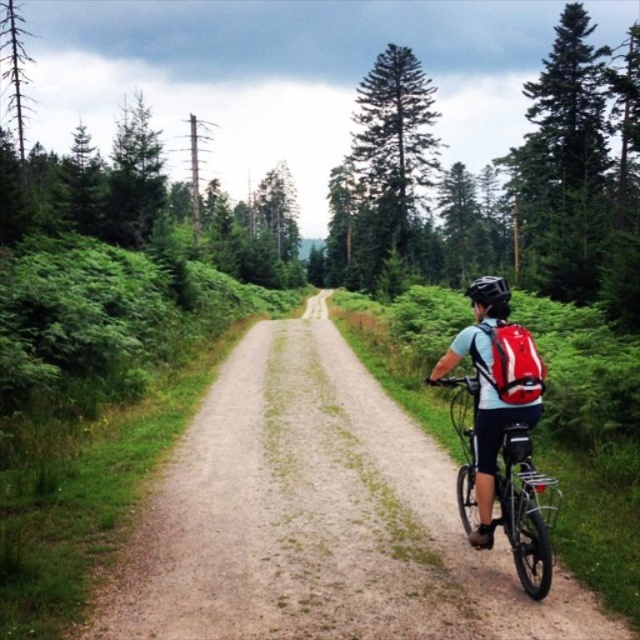
Question: Among these objects, which one is farthest from the camera?

Choices:
 (A) dirt/gravel path at center
 (B) red matte bicycle at right

Answer: (B)

Question: Does dirt/gravel path at center have a lesser width compared to red matte bicycle at right?

Choices:
 (A) no
 (B) yes

Answer: (A)

Question: Is dirt/gravel path at center to the left of red matte bicycle at right from the viewer's perspective?

Choices:
 (A) no
 (B) yes

Answer: (B)

Question: Observing the image, what is the correct spatial positioning of dirt/gravel path at center in reference to red matte bicycle at right?

Choices:
 (A) below
 (B) above

Answer: (A)